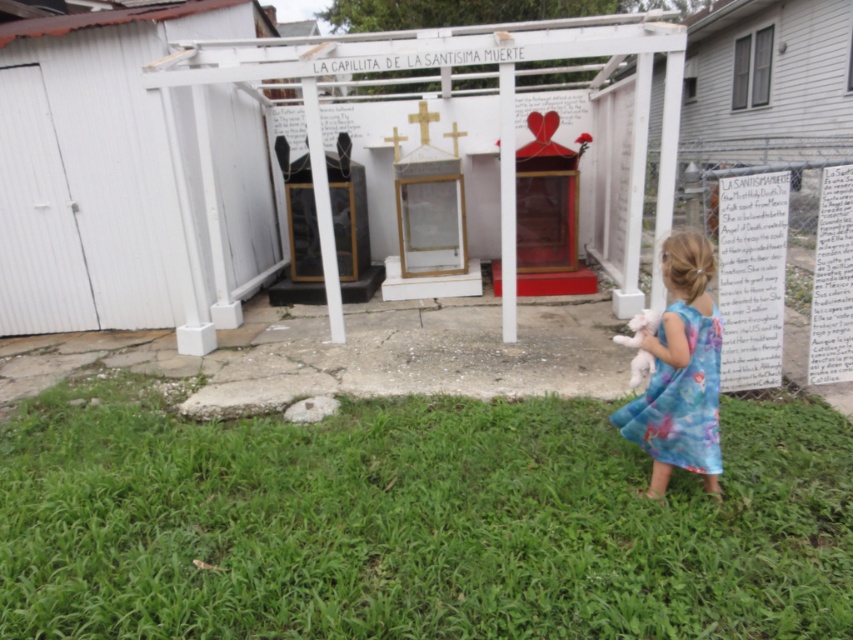
Find the location of a particular element. Image resolution: width=853 pixels, height=640 pixels. green grass at lower center is located at coordinates (415, 522).

Between green grass at lower center and blue floral dress at lower right, which one is positioned lower?

Positioned lower is green grass at lower center.

Between point (97, 573) and point (689, 388), which one is positioned in front?

Point (97, 573) is in front.

What are the coordinates of `green grass at lower center` in the screenshot? It's located at (415, 522).